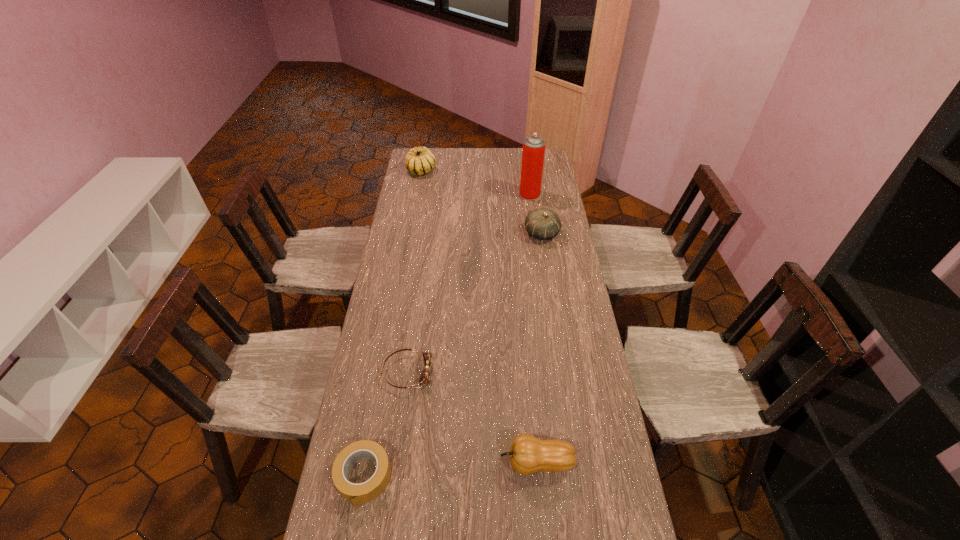
Locate an element on the screen. the fifth nearest object is located at coordinates (533, 152).

What are the coordinates of `aerosol can` in the screenshot? It's located at (x=533, y=152).

Find the location of a particular element. the leftmost gourd is located at coordinates (419, 160).

Find the location of a particular element. the farthest object is located at coordinates (419, 160).

Where is `the third farthest object`? the third farthest object is located at coordinates (544, 224).

Where is `the nearest gourd`? The height and width of the screenshot is (540, 960). the nearest gourd is located at coordinates (528, 454).

This screenshot has height=540, width=960. In order to click on duct tape in this screenshot , I will do `click(364, 492)`.

This screenshot has height=540, width=960. I want to click on goggles, so click(x=425, y=375).

What are the coordinates of `vacant position located on the front of the second farthest object` in the screenshot? It's located at (535, 231).

This screenshot has width=960, height=540. I want to click on vacant space located on the front of the farthest object, so click(412, 225).